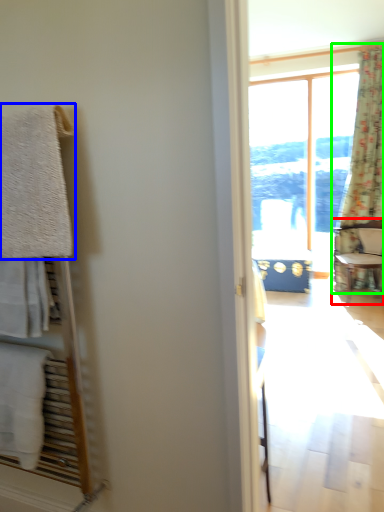
Question: Which object is the farthest from chair (highlighted by a red box)? Choose among these: towel/napkin (highlighted by a blue box) or curtain (highlighted by a green box).

Choices:
 (A) towel/napkin
 (B) curtain

Answer: (A)